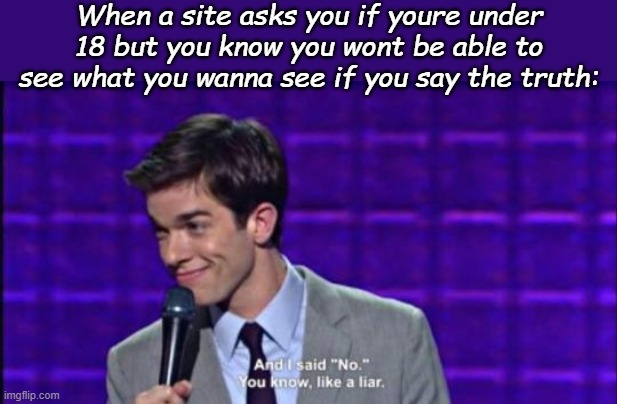
Locate an element on the screen. black mic is located at coordinates (181, 332).